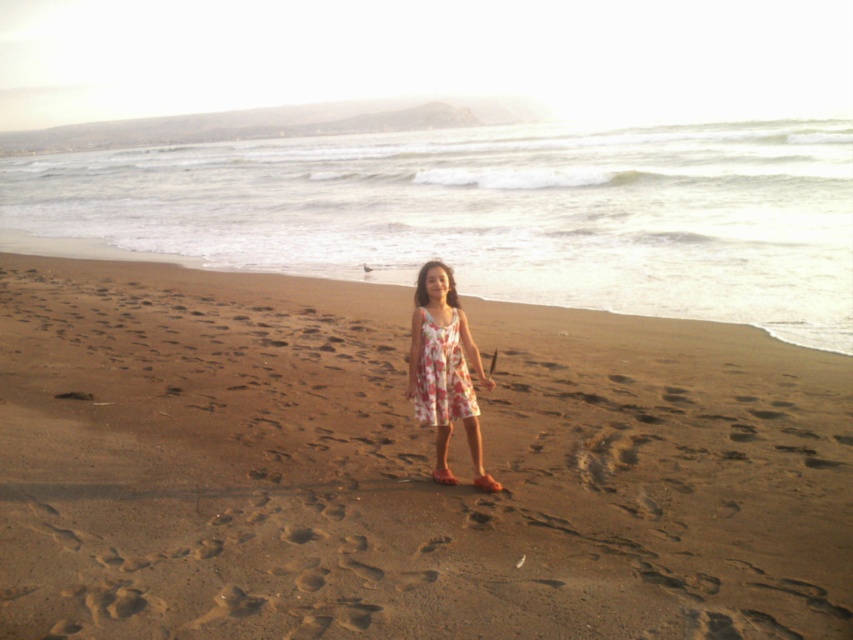
Question: Which of these objects is positioned farthest from the brown sandy beach at center?

Choices:
 (A) floral cotton dress at center
 (B) floral fabric dress at center

Answer: (B)

Question: Which point appears farthest from the camera in this image?

Choices:
 (A) (7, 372)
 (B) (444, 403)

Answer: (A)

Question: Which object is the farthest from the floral fabric dress at center?

Choices:
 (A) brown sandy beach at center
 (B) floral cotton dress at center

Answer: (A)

Question: Does floral fabric dress at center have a smaller size compared to floral cotton dress at center?

Choices:
 (A) yes
 (B) no

Answer: (B)

Question: Is brown sandy beach at center thinner than floral cotton dress at center?

Choices:
 (A) yes
 (B) no

Answer: (B)

Question: Is brown sandy beach at center above floral fabric dress at center?

Choices:
 (A) no
 (B) yes

Answer: (A)